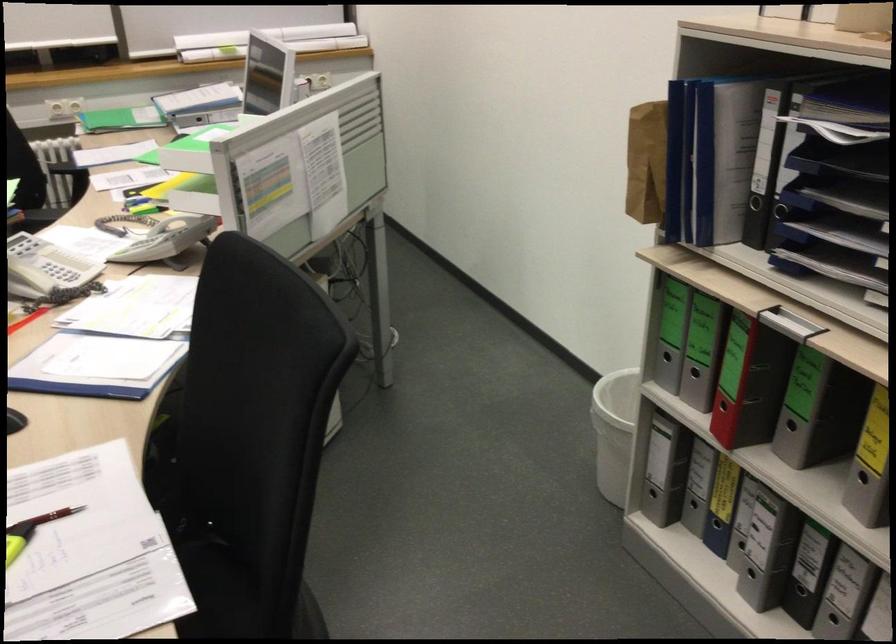
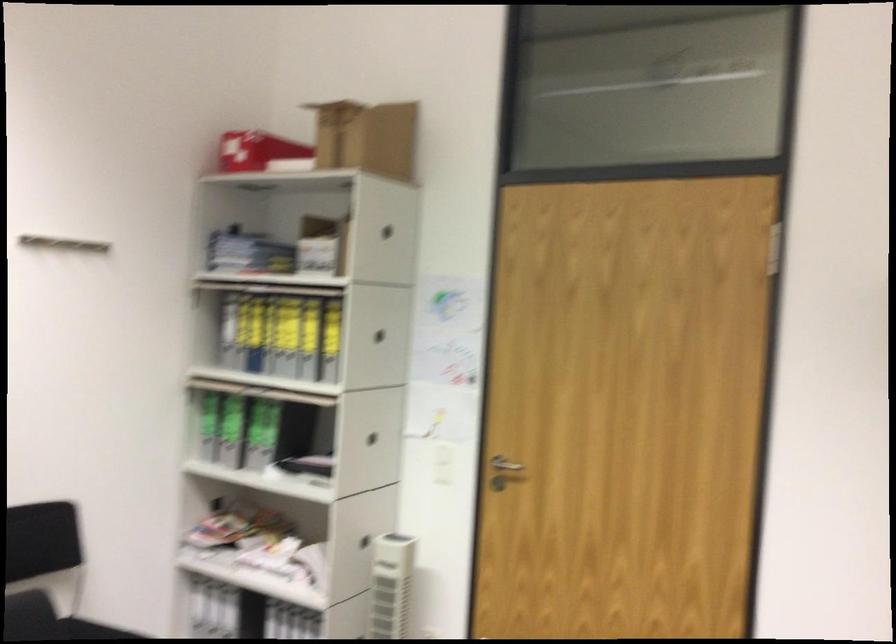
Locate, in the second image, the point that corresponds to pixel 330 411 in the first image.

(48, 621)